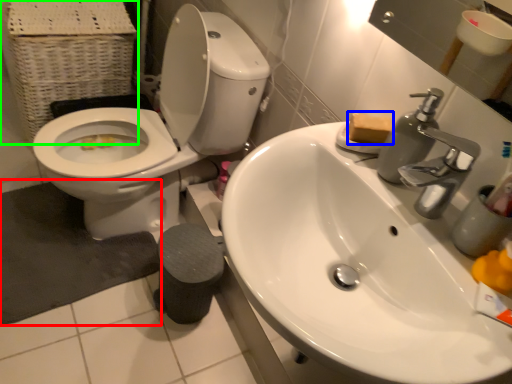
Question: Which is farther away from bath mat (highlighted by a red box)? soap (highlighted by a blue box) or basket (highlighted by a green box)?

Choices:
 (A) soap
 (B) basket

Answer: (A)